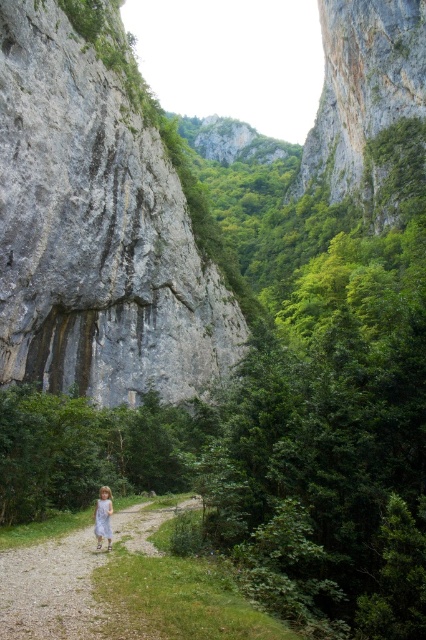
Based on the photo, can you confirm if gravel path at center is positioned to the right of white cotton dress at center?

Indeed, gravel path at center is positioned on the right side of white cotton dress at center.

Which is more to the right, gravel path at center or white cotton dress at center?

gravel path at center

Is point (11, 552) closer to camera compared to point (104, 516)?

Yes, point (11, 552) is closer to viewer.

Locate an element on the screen. This screenshot has height=640, width=426. gravel path at center is located at coordinates [x=58, y=593].

Can you confirm if rough stone cliff at upper center is taller than white cotton dress at center?

Indeed, rough stone cliff at upper center has a greater height compared to white cotton dress at center.

Is rough stone cliff at upper center closer to camera compared to white cotton dress at center?

No, it is behind white cotton dress at center.

Which is behind, point (403, 106) or point (98, 528)?

The point (403, 106) is more distant.

What are the coordinates of `rough stone cliff at upper center` in the screenshot? It's located at (362, 97).

Which is more to the left, rough gray rock at center or rough stone cliff at upper center?

rough gray rock at center is more to the left.

Where is `rough gray rock at center`? The height and width of the screenshot is (640, 426). rough gray rock at center is located at coordinates 95,230.

Where is `rough gray rock at center`? This screenshot has width=426, height=640. rough gray rock at center is located at coordinates (95, 230).